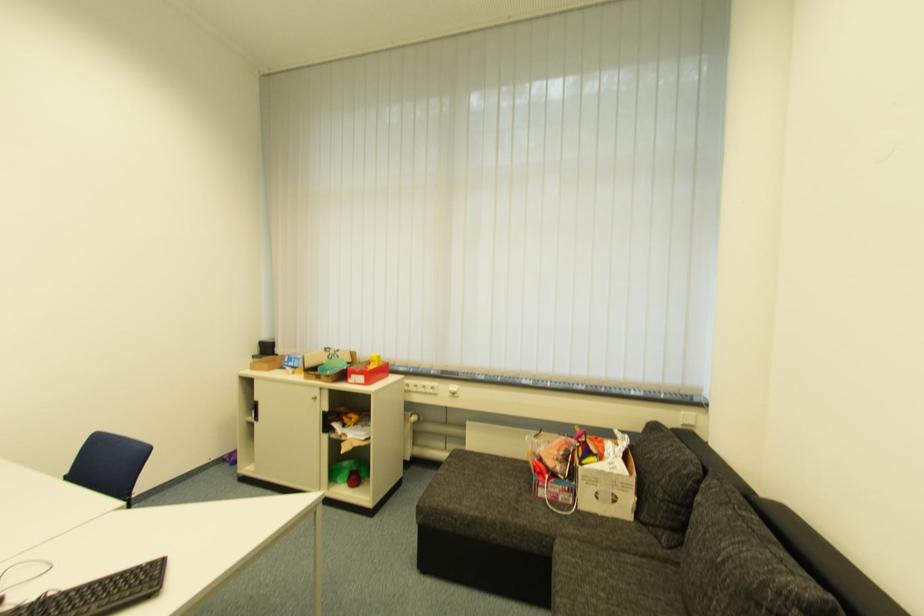
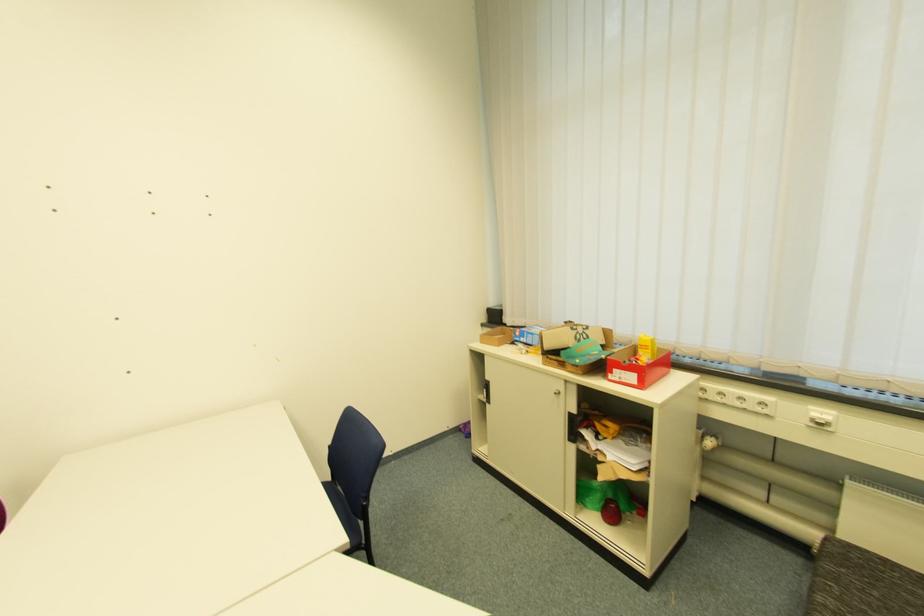
Question: Based on the continuous images, in which direction is the camera rotating? Reply with the corresponding letter.

Choices:
 (A) Left
 (B) Right
 (C) Up
 (D) Down

Answer: (A)